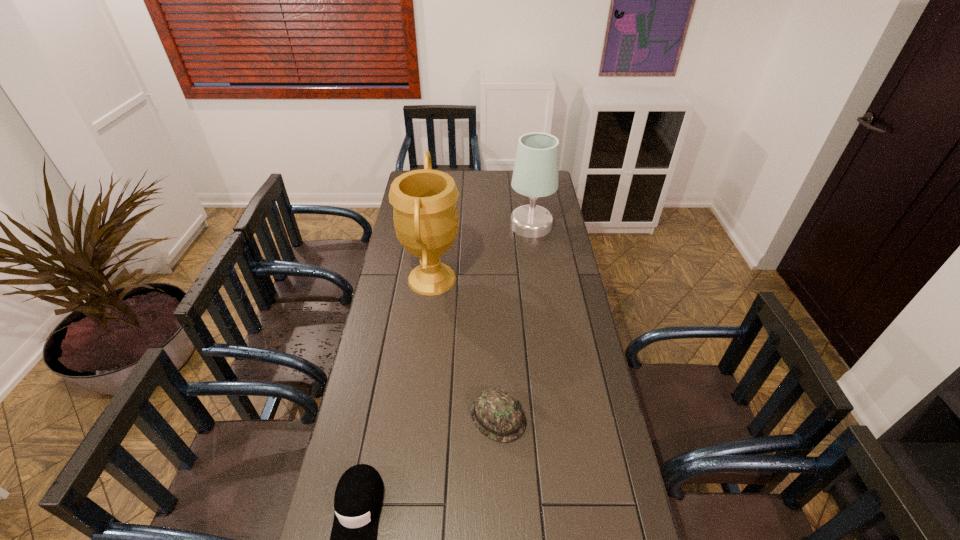
The image size is (960, 540). Find the location of `the third nearest object`. the third nearest object is located at coordinates pyautogui.click(x=426, y=220).

Find the location of `the farthest object`. the farthest object is located at coordinates (535, 174).

At what (x,y) coordinates should I click in order to perform the action: click on the second nearest object. Please return your answer as a coordinate pair (x, y). Image resolution: width=960 pixels, height=540 pixels. Looking at the image, I should click on (495, 412).

I want to click on the right cap, so (495, 412).

Image resolution: width=960 pixels, height=540 pixels. What are the coordinates of `vacant area situated on the engravings side of the third nearest object` in the screenshot? It's located at (504, 279).

Locate an element on the screen. free point located on the base of the lampshade is located at coordinates (540, 289).

Locate an element on the screen. free space located 0.240m on the left of the third farthest object is located at coordinates (392, 417).

What are the coordinates of `object at the left edge` in the screenshot? It's located at (426, 220).

Identify the location of object that is at the right edge. The image size is (960, 540). [535, 174].

The width and height of the screenshot is (960, 540). What are the coordinates of `vacant region at the left edge of the desktop` in the screenshot? It's located at (395, 301).